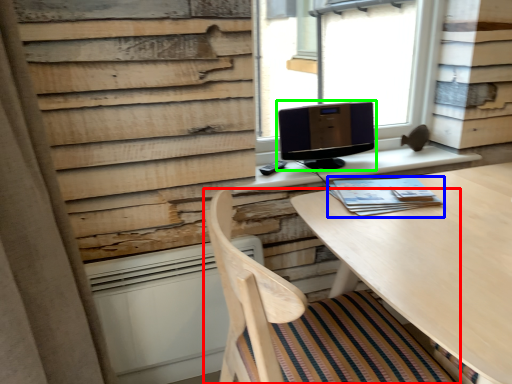
Question: Which object is the farthest from chair (highlighted by a red box)? Choose among these: book (highlighted by a blue box) or computer monitor (highlighted by a green box).

Choices:
 (A) book
 (B) computer monitor

Answer: (B)